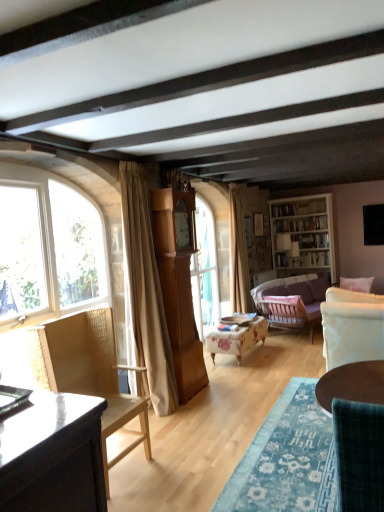
The width and height of the screenshot is (384, 512). I want to click on white wooden bookshelf at upper right, so click(303, 234).

Measure the distance between beige fabric curtain at left, the second curtain from the back, and camera.

A distance of 3.63 meters exists between beige fabric curtain at left, the second curtain from the back, and camera.

Image resolution: width=384 pixels, height=512 pixels. Identify the location of beige fabric curtain at center, placed as the 1th curtain when sorted from back to front. (238, 256).

The height and width of the screenshot is (512, 384). I want to click on velvet purple couch at center right, so click(x=292, y=301).

Where is `clear glass window at left`? This screenshot has height=512, width=384. clear glass window at left is located at coordinates (65, 239).

Considering the relative sizes of floral fabric ottoman at center, positioned as the 2th chair in right-to-left order, and clear glass window at left in the image provided, is floral fabric ottoman at center, positioned as the 2th chair in right-to-left order, shorter than clear glass window at left?

Yes, floral fabric ottoman at center, positioned as the 2th chair in right-to-left order, is shorter than clear glass window at left.

Which object is closer to the camera, floral fabric ottoman at center, which is counted as the 3th chair, starting from the front, or clear glass window at left?

Positioned in front is clear glass window at left.

Consider the image. From a real-world perspective, is floral fabric ottoman at center, the 1th chair in the back-to-front sequence, located higher than clear glass window at left?

No, from a real-world perspective, floral fabric ottoman at center, the 1th chair in the back-to-front sequence, is not on top of clear glass window at left.

Considering the sizes of objects floral fabric ottoman at center, the 2th chair in the left-to-right sequence, and clear glass window at left in the image provided, who is wider, floral fabric ottoman at center, the 2th chair in the left-to-right sequence, or clear glass window at left?

floral fabric ottoman at center, the 2th chair in the left-to-right sequence, is wider.

From the image's perspective, between light brown wood grandfather clock at center and velvet teal chair at lower right, the third chair when ordered from left to right, which one is located above?

light brown wood grandfather clock at center is shown above in the image.

In terms of height, does light brown wood grandfather clock at center look taller or shorter compared to velvet teal chair at lower right, arranged as the 1th chair when viewed from the front?

In the image, light brown wood grandfather clock at center appears to be taller than velvet teal chair at lower right, arranged as the 1th chair when viewed from the front.

Would you consider light brown wood grandfather clock at center to be distant from velvet teal chair at lower right, which ranks as the 3th chair in back-to-front order?

That's right, there is a large distance between light brown wood grandfather clock at center and velvet teal chair at lower right, which ranks as the 3th chair in back-to-front order.

Which is nearer, (192, 189) or (359, 475)?

Point (359, 475)

From the image's perspective, which is below, velvet teal chair at lower right, which ranks as the 3th chair in back-to-front order, or white wooden bookshelf at upper right?

velvet teal chair at lower right, which ranks as the 3th chair in back-to-front order, appears lower in the image.

Considering the sizes of velvet teal chair at lower right, which ranks as the 3th chair in back-to-front order, and white wooden bookshelf at upper right in the image, is velvet teal chair at lower right, which ranks as the 3th chair in back-to-front order, taller or shorter than white wooden bookshelf at upper right?

Considering their sizes, velvet teal chair at lower right, which ranks as the 3th chair in back-to-front order, has less height than white wooden bookshelf at upper right.

Which of these two, velvet teal chair at lower right, arranged as the 1th chair when viewed from the front, or white wooden bookshelf at upper right, is bigger?

white wooden bookshelf at upper right.

Considering the relative sizes of woven wood chair at left, which ranks as the second chair in front-to-back order, and light brown wood grandfather clock at center in the image provided, is woven wood chair at left, which ranks as the second chair in front-to-back order, thinner than light brown wood grandfather clock at center?

No, woven wood chair at left, which ranks as the second chair in front-to-back order, is not thinner than light brown wood grandfather clock at center.

From a real-world perspective, is woven wood chair at left, which appears as the third chair when viewed from the right, above or below light brown wood grandfather clock at center?

Clearly, from a real-world perspective, woven wood chair at left, which appears as the third chair when viewed from the right, is below light brown wood grandfather clock at center.

Is point (8, 335) less distant than point (194, 332)?

Yes.

Which of these two, woven wood chair at left, which appears as the third chair when viewed from the right, or light brown wood grandfather clock at center, is smaller?

Smaller between the two is light brown wood grandfather clock at center.

Is velvet teal chair at lower right, which ranks as the 3th chair in back-to-front order, oriented away from velvet purple couch at center right?

velvet teal chair at lower right, which ranks as the 3th chair in back-to-front order, does not have its back to velvet purple couch at center right.

Considering the positions of objects velvet teal chair at lower right, arranged as the 1th chair when viewed from the front, and velvet purple couch at center right in the image provided, who is more to the right, velvet teal chair at lower right, arranged as the 1th chair when viewed from the front, or velvet purple couch at center right?

From the viewer's perspective, velvet purple couch at center right appears more on the right side.

Is velvet teal chair at lower right, the 1th chair positioned from the right, touching velvet purple couch at center right?

No, velvet teal chair at lower right, the 1th chair positioned from the right, is not in contact with velvet purple couch at center right.

Where is `studio couch located on the right of velvet teal chair at lower right, the 1th chair positioned from the right`? The image size is (384, 512). studio couch located on the right of velvet teal chair at lower right, the 1th chair positioned from the right is located at coordinates (292, 301).

From the image's perspective, between light brown wood grandfather clock at center and beige fabric curtain at left, the second curtain from the back, which one is located above?

beige fabric curtain at left, the second curtain from the back, from the image's perspective.

Relative to beige fabric curtain at left, the 1th curtain from the left, is light brown wood grandfather clock at center in front or behind?

In the image, light brown wood grandfather clock at center appears behind beige fabric curtain at left, the 1th curtain from the left.

Can you confirm if light brown wood grandfather clock at center is shorter than beige fabric curtain at left, the second curtain from the back?

Correct, light brown wood grandfather clock at center is not as tall as beige fabric curtain at left, the second curtain from the back.

Which is closer, (188, 211) or (170, 409)?

Point (188, 211) is farther from the camera than point (170, 409).

From a real-world perspective, is white wooden bookshelf at upper right positioned under velvet purple couch at center right based on gravity?

No.

Which is in front, white wooden bookshelf at upper right or velvet purple couch at center right?

velvet purple couch at center right is closer to the camera.

Is white wooden bookshelf at upper right turned away from velvet purple couch at center right?

No, white wooden bookshelf at upper right is not facing away from velvet purple couch at center right.

In the scene shown: Which is more to the right, white wooden bookshelf at upper right or velvet purple couch at center right?

white wooden bookshelf at upper right is more to the right.

Locate an element on the screen. Image resolution: width=384 pixels, height=512 pixels. window above the floral fabric ottoman at center, the 2th chair in the left-to-right sequence (from the image's perspective) is located at coordinates (65, 239).

You are a GUI agent. You are given a task and a screenshot of the screen. Output one action in this format:
    pyautogui.click(x=<x>, y=<y>)
    Task: Click on the wide behind the velvet teal chair at lower right, the 1th chair positioned from the right
    
    Given the screenshot: What is the action you would take?
    pyautogui.click(x=178, y=284)

From the picture: Considering their positions, is white wooden bookshelf at upper right positioned closer to light brown wood grandfather clock at center than beige fabric curtain at center, placed as the 1th curtain when sorted from back to front?

beige fabric curtain at center, placed as the 1th curtain when sorted from back to front.

Which object lies nearer to the anchor point velvet teal chair at lower right, arranged as the 1th chair when viewed from the front, light brown wood grandfather clock at center or woven wood chair at left, marked as the second chair in a back-to-front arrangement?

Based on the image, woven wood chair at left, marked as the second chair in a back-to-front arrangement, appears to be nearer to velvet teal chair at lower right, arranged as the 1th chair when viewed from the front.

Considering their positions, is woven wood chair at left, which appears as the third chair when viewed from the right, positioned further to clear glass window at left than velvet teal chair at lower right, the 1th chair positioned from the right?

Based on the image, velvet teal chair at lower right, the 1th chair positioned from the right, appears to be further to clear glass window at left.

When comparing their distances from velvet teal chair at lower right, the third chair when ordered from left to right, does beige fabric curtain at left, acting as the 1th curtain starting from the front, or light brown wood grandfather clock at center seem closer?

Based on the image, beige fabric curtain at left, acting as the 1th curtain starting from the front, appears to be nearer to velvet teal chair at lower right, the third chair when ordered from left to right.

Based on their spatial positions, is light brown wood grandfather clock at center or woven wood chair at left, which is the 1th chair from left to right, further from white wooden bookshelf at upper right?

Based on the image, woven wood chair at left, which is the 1th chair from left to right, appears to be further to white wooden bookshelf at upper right.

Considering their positions, is beige fabric curtain at left, the second curtain from the back, positioned further to floral fabric ottoman at center, positioned as the 2th chair in right-to-left order, than beige fabric curtain at center, which is the 1th curtain from right to left?

beige fabric curtain at left, the second curtain from the back, is positioned further to the anchor floral fabric ottoman at center, positioned as the 2th chair in right-to-left order.

Estimate the real-world distances between objects in this image. Which object is further from beige fabric curtain at left, the second curtain from the back, white wooden bookshelf at upper right or light brown wood grandfather clock at center?

white wooden bookshelf at upper right lies further to beige fabric curtain at left, the second curtain from the back, than the other object.

When comparing their distances from woven wood chair at left, which ranks as the second chair in front-to-back order, does floral fabric ottoman at center, the 2th chair in the left-to-right sequence, or beige fabric curtain at left, placed as the second curtain when sorted from right to left, seem closer?

beige fabric curtain at left, placed as the second curtain when sorted from right to left, is closer to woven wood chair at left, which ranks as the second chair in front-to-back order.

Where is `wide between beige fabric curtain at left, the 1th curtain from the left, and velvet purple couch at center right`? The image size is (384, 512). wide between beige fabric curtain at left, the 1th curtain from the left, and velvet purple couch at center right is located at coordinates (178, 284).

Where is `curtain between velvet teal chair at lower right, which ranks as the 3th chair in back-to-front order, and velvet purple couch at center right in the front-back direction`? The width and height of the screenshot is (384, 512). curtain between velvet teal chair at lower right, which ranks as the 3th chair in back-to-front order, and velvet purple couch at center right in the front-back direction is located at coordinates 145,294.

You are a GUI agent. You are given a task and a screenshot of the screen. Output one action in this format:
    pyautogui.click(x=<x>, y=<y>)
    Task: Click on the curtain between beige fabric curtain at left, the 1th curtain from the left, and white wooden bookshelf at upper right, along the z-axis
    This screenshot has height=512, width=384.
    Given the screenshot: What is the action you would take?
    pyautogui.click(x=238, y=256)

At what (x,y) coordinates should I click in order to perform the action: click on studio couch between light brown wood grandfather clock at center and beige fabric curtain at center, placed as the 1th curtain when sorted from back to front, along the z-axis. Please return your answer as a coordinate pair (x, y). The image size is (384, 512). Looking at the image, I should click on (292, 301).